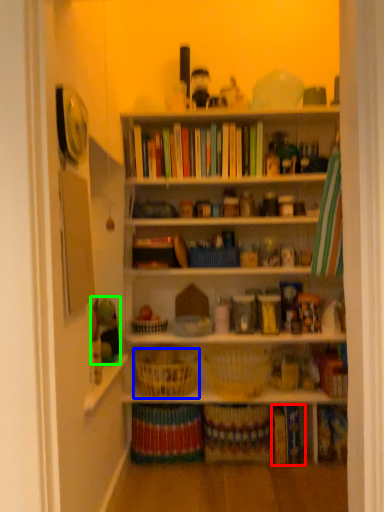
Question: Considering the real-world distances, which object is farthest from book (highlighted by a red box)? basket (highlighted by a blue box) or toy (highlighted by a green box)?

Choices:
 (A) basket
 (B) toy

Answer: (B)